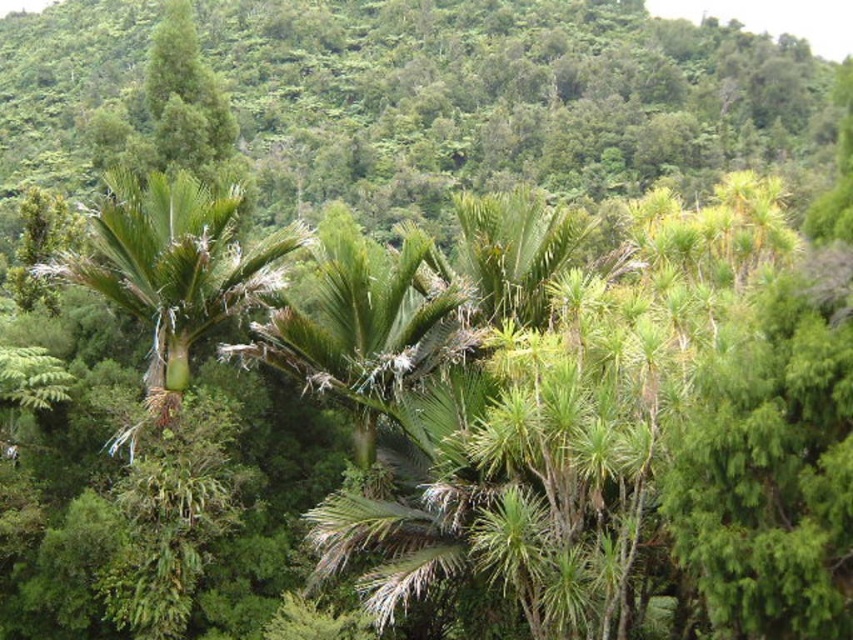
Question: Among these objects, which one is nearest to the camera?

Choices:
 (A) green leafy palm tree at center
 (B) green leafy palm at left

Answer: (A)

Question: Does green leafy palm at left have a smaller size compared to green leafy palm tree at center?

Choices:
 (A) no
 (B) yes

Answer: (A)

Question: Where is green leafy palm at left located in relation to green leafy palm tree at center in the image?

Choices:
 (A) above
 (B) below

Answer: (A)

Question: Is green leafy palm at left smaller than green leafy palm tree at center?

Choices:
 (A) no
 (B) yes

Answer: (A)

Question: Which point is farther to the camera?

Choices:
 (A) (412, 344)
 (B) (180, 372)

Answer: (B)